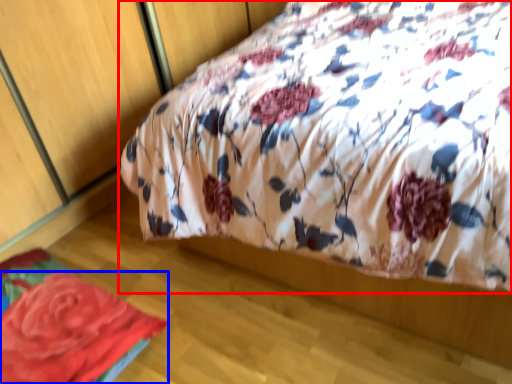
Question: Which point is closer to the camera, bed (highlighted by a red box) or rose (highlighted by a blue box)?

Choices:
 (A) bed
 (B) rose

Answer: (A)